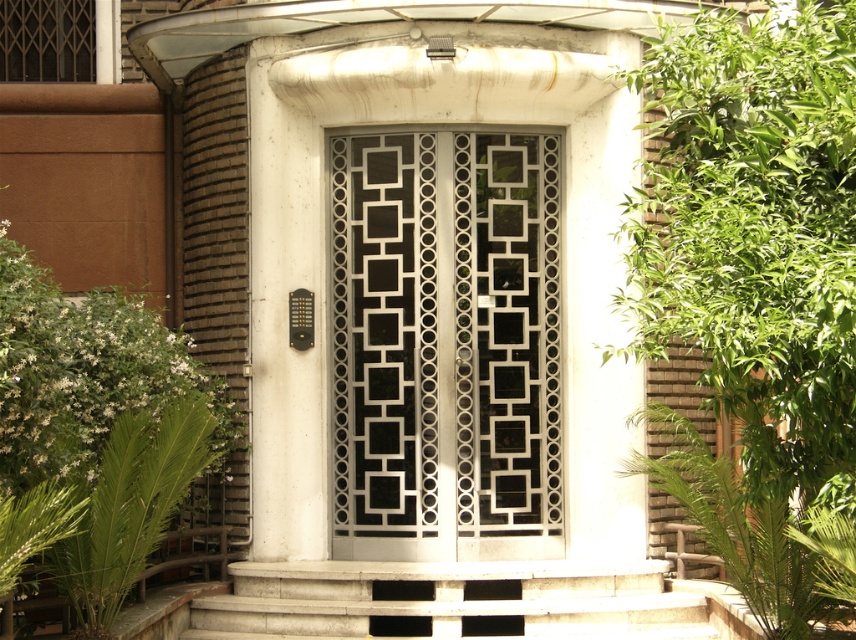
You are standing in front of the entrance and want to determine the relative positions of two points marked on the entrance structure. Which point is closer to you, point 1 at coordinates (712, 52) or point 2 at coordinates (720, 508)?

Point 1 at coordinates (712, 52) is closer to you than point 2 at coordinates (720, 508).

You are standing at the base of the steps leading to the entrance. You want to place a new small potted plant between the green leafy plant at right and the green leafy plant at lower right. Which side of the space between them should you place it to ensure it doesn not block the path? Consider their widths.

The green leafy plant at right has a lesser width compared to the green leafy plant at lower right. Therefore, placing the new potted plant closer to the green leafy plant at right would leave more space on the wider side of the green leafy plant at lower right, ensuring the path remains unobstructed.